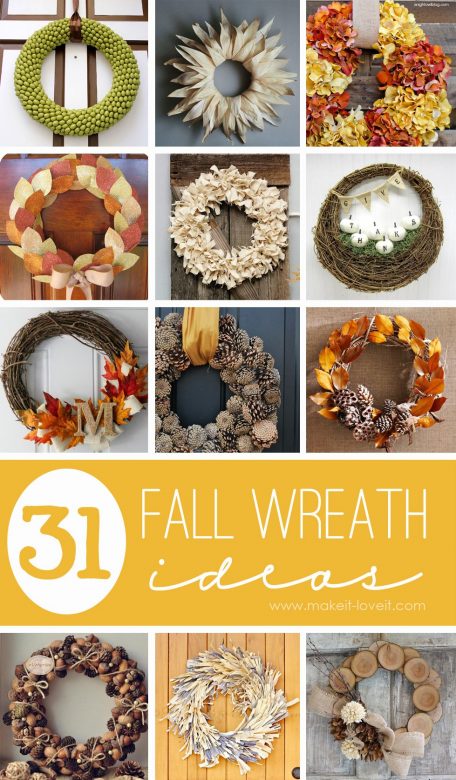
Where is `wreath`? This screenshot has height=780, width=456. wreath is located at coordinates (318, 498).